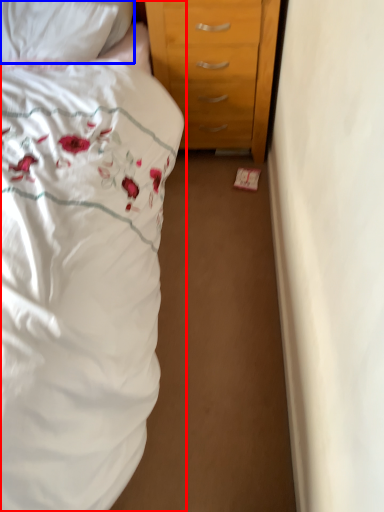
Question: Which of the following is the farthest to the observer, bed (highlighted by a red box) or pillow (highlighted by a blue box)?

Choices:
 (A) bed
 (B) pillow

Answer: (B)